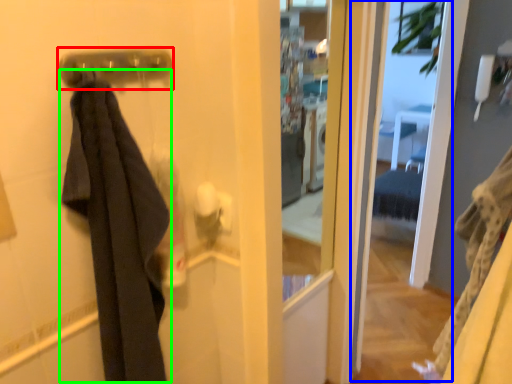
Question: Considering the real-world distances, which object is farthest from door handle (highlighted by a red box)? screen door (highlighted by a blue box) or clothing (highlighted by a green box)?

Choices:
 (A) screen door
 (B) clothing

Answer: (A)